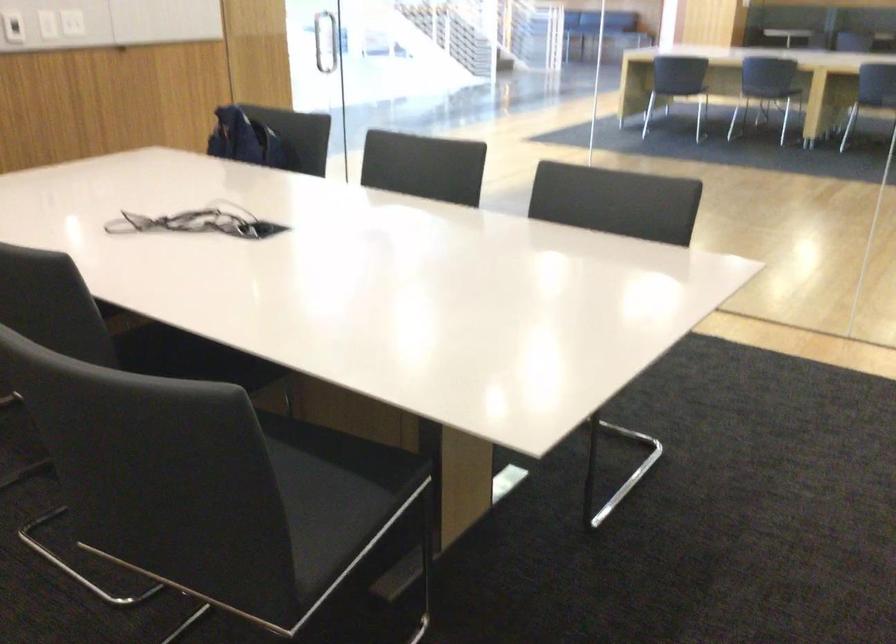
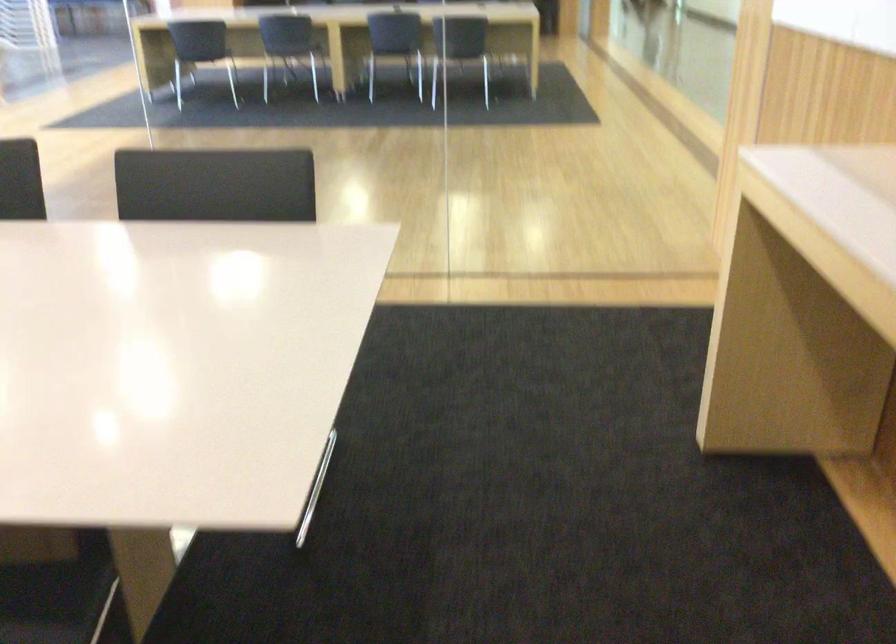
Find the pixel in the second image that matches (x=373, y=474) in the first image.

(55, 601)